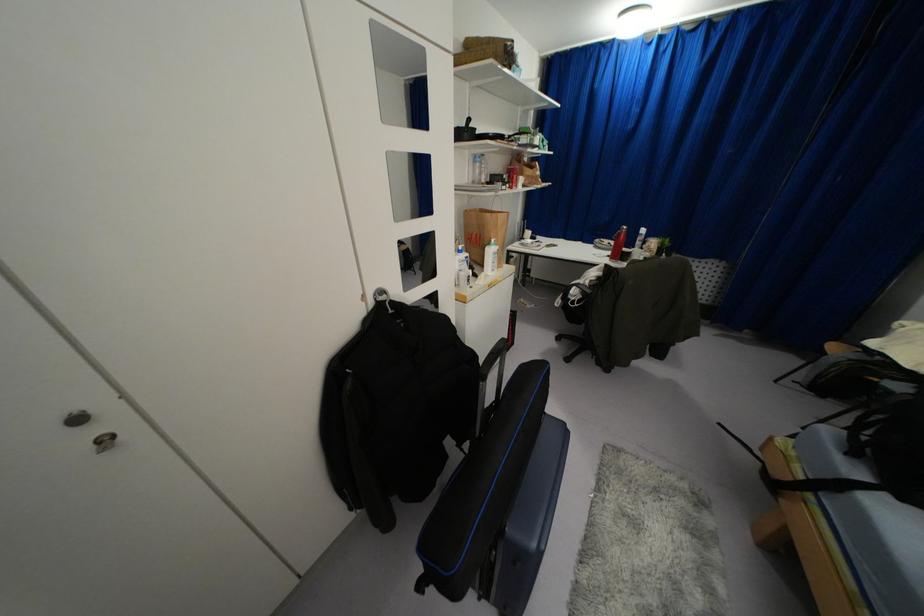
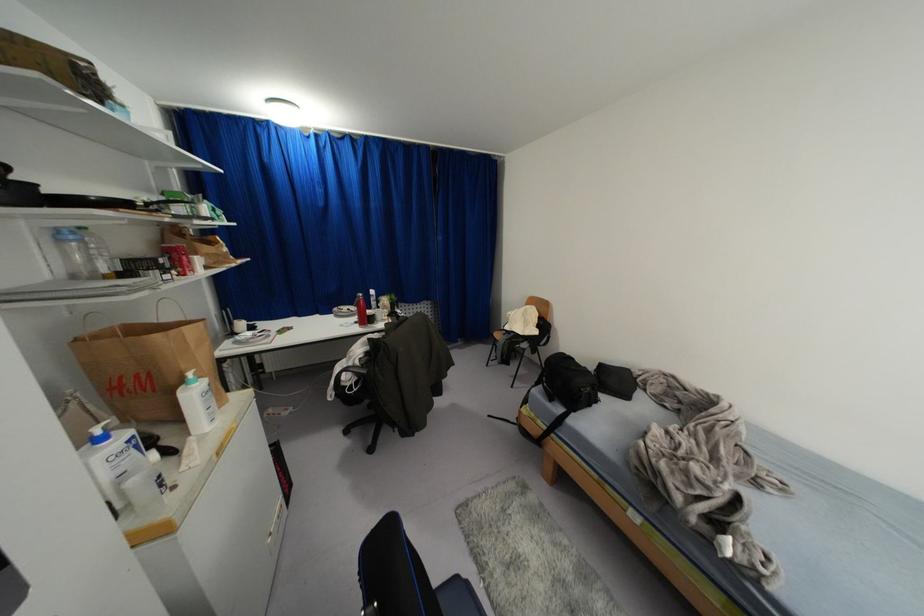
Where in the second image is the point corresponding to point (475, 161) from the first image?

(62, 240)